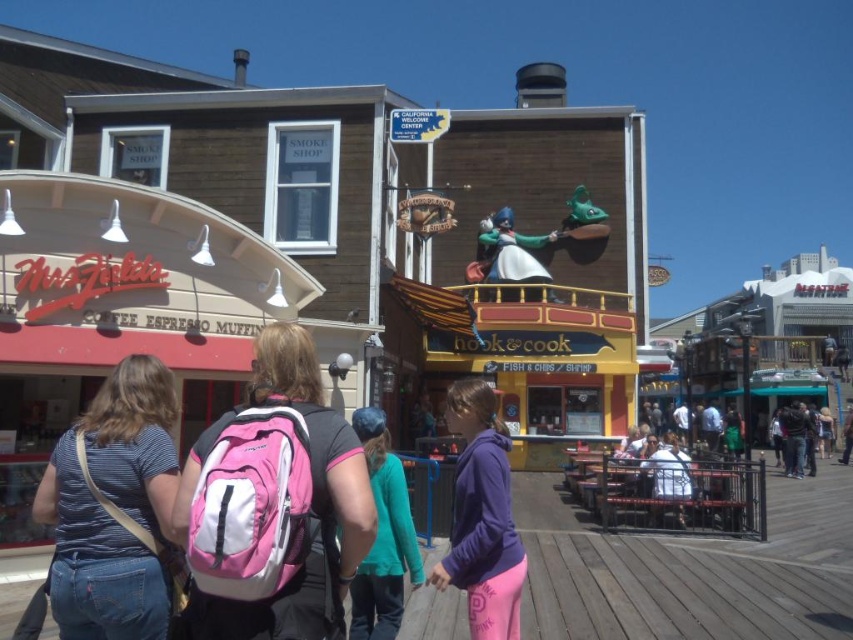
Does purple fleece jacket at center have a greater height compared to white fabric shirt at center?

In fact, purple fleece jacket at center may be shorter than white fabric shirt at center.

Can you confirm if purple fleece jacket at center is positioned below white fabric shirt at center?

No.

Is point (508, 468) behind point (668, 440)?

No, it is not.

Where is `purple fleece jacket at center`? purple fleece jacket at center is located at coordinates tap(482, 516).

Does pink fabric backpack at center have a greater width compared to teal fabric shirt at center?

Indeed, pink fabric backpack at center has a greater width compared to teal fabric shirt at center.

Which is in front, point (270, 522) or point (378, 508)?

Point (270, 522) is more forward.

Between point (364, 465) and point (383, 611), which one is positioned behind?

Point (383, 611)

This screenshot has height=640, width=853. Find the location of `pink fabric backpack at center`. pink fabric backpack at center is located at coordinates (274, 504).

Can you confirm if denim jeans at lower left is positioned to the right of purple fleece jacket at center?

Incorrect, denim jeans at lower left is not on the right side of purple fleece jacket at center.

Which is below, denim jeans at lower left or purple fleece jacket at center?

Positioned lower is purple fleece jacket at center.

At what (x,y) coordinates should I click in order to perform the action: click on denim jeans at lower left. Please return your answer as a coordinate pair (x, y). This screenshot has width=853, height=640. Looking at the image, I should click on (114, 508).